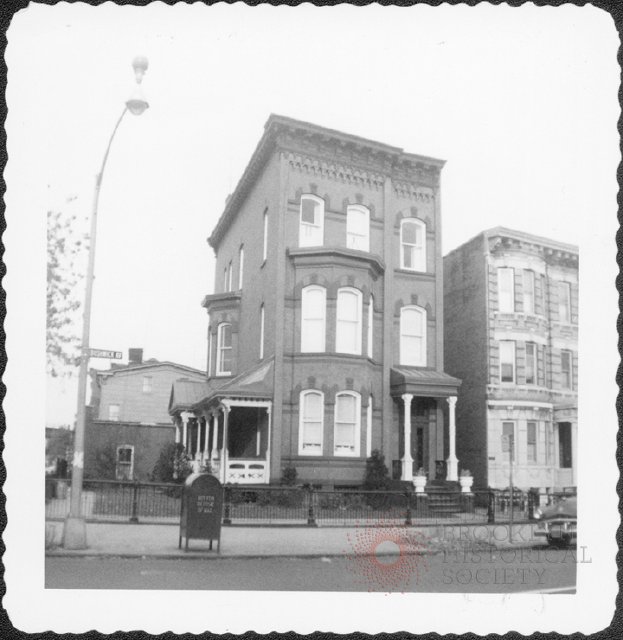
Where is `door`? The width and height of the screenshot is (623, 640). door is located at coordinates (126, 464), (416, 431), (569, 445).